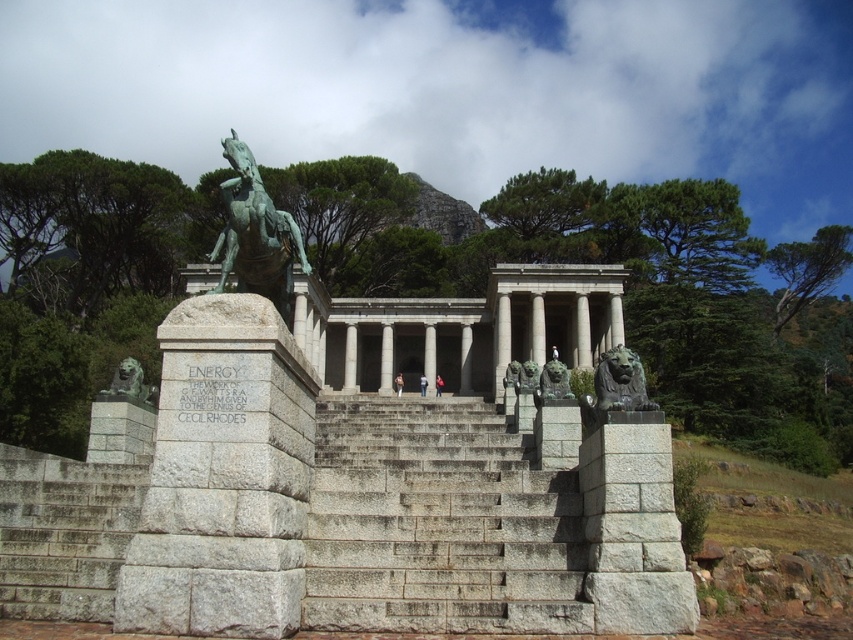
You are an architect examining the memorial. You need to determine the spatial relationship between the gray stone pillar at center and the bronze lion at right. Which object is positioned higher in elevation?

The bronze lion at right is positioned higher in elevation than the gray stone pillar at center, as the gray stone pillar at center is located below it.